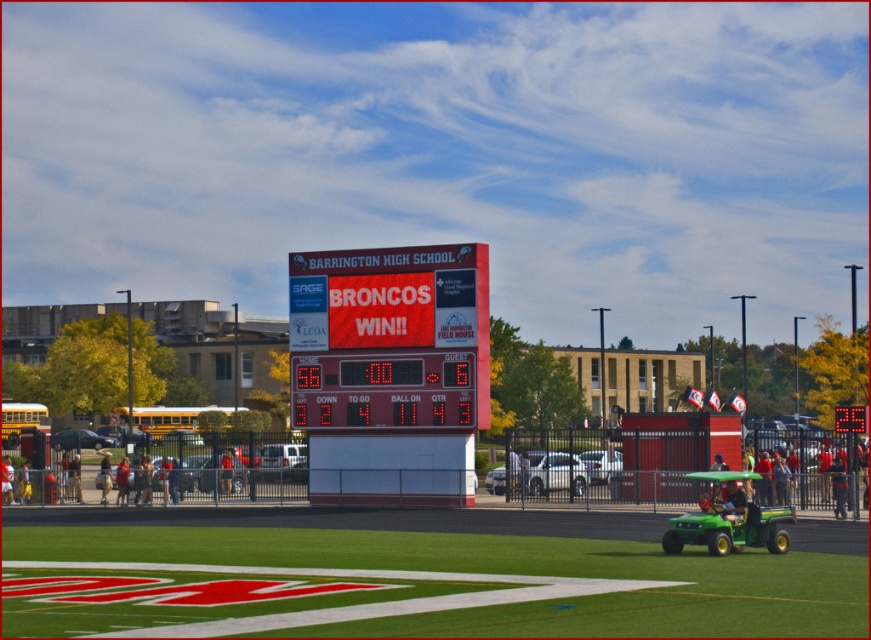
Question: Among these objects, which one is nearest to the camera?

Choices:
 (A) green artificial turf at center
 (B) red shirt at center
 (C) denim jacket at lower left

Answer: (A)

Question: Among these objects, which one is nearest to the camera?

Choices:
 (A) denim jacket at lower left
 (B) white digital scoreboard at center
 (C) green artificial turf at center

Answer: (C)

Question: Which of these objects is positioned farthest from the digital display scoreboard at center?

Choices:
 (A) white digital scoreboard at center
 (B) green artificial turf at center
 (C) denim jacket at lower left
 (D) white cotton shirt at center

Answer: (B)

Question: In this image, where is green artificial turf at center located relative to digital display scoreboard at center?

Choices:
 (A) left
 (B) right

Answer: (B)

Question: Does denim jacket at lower left have a greater width compared to red shirt at center?

Choices:
 (A) no
 (B) yes

Answer: (B)

Question: Is green artificial turf at center wider than white digital scoreboard at center?

Choices:
 (A) yes
 (B) no

Answer: (A)